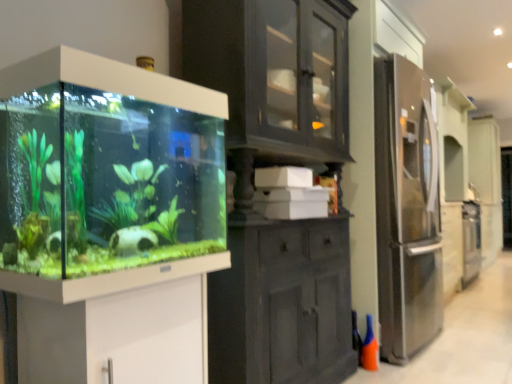
Question: Is orange matte cone at lower right inside the boundaries of transparent glass aquarium at left, or outside?

Choices:
 (A) inside
 (B) outside

Answer: (B)

Question: Would you say orange matte cone at lower right is to the left or to the right of transparent glass aquarium at left in the picture?

Choices:
 (A) right
 (B) left

Answer: (A)

Question: Which is farther from the orange matte cone at lower right?

Choices:
 (A) white glossy vanity at lower left
 (B) transparent glass aquarium at left

Answer: (B)

Question: Which is nearer to the orange matte cone at lower right?

Choices:
 (A) white glossy vanity at lower left
 (B) transparent glass aquarium at left

Answer: (A)